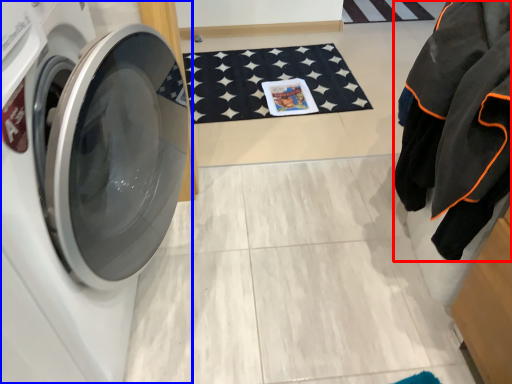
Question: Which object is closer to the camera taking this photo, clothing (highlighted by a red box) or washing machine (highlighted by a blue box)?

Choices:
 (A) clothing
 (B) washing machine

Answer: (B)